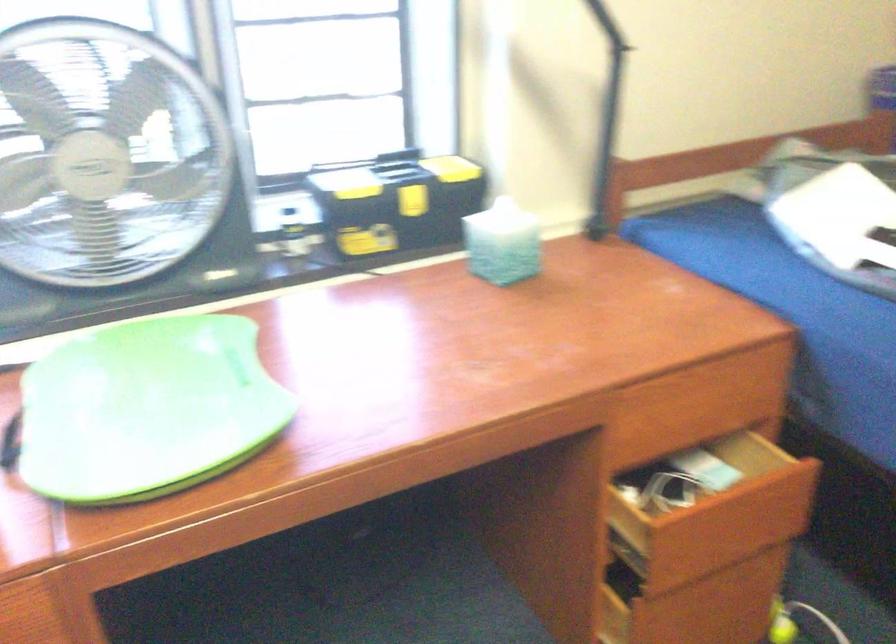
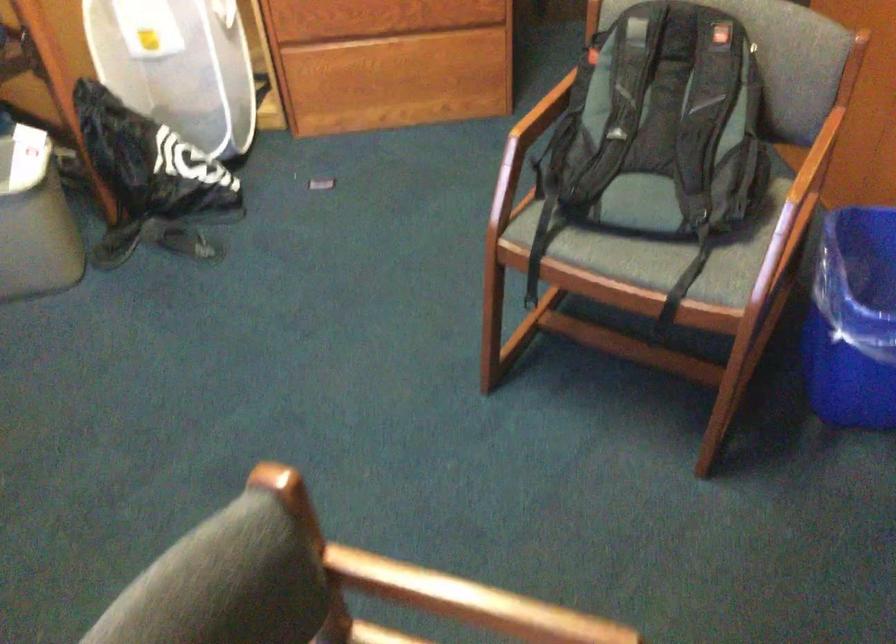
The images are taken continuously from a first-person perspective. In which direction is your viewpoint rotating?

The camera rotated toward right-down.